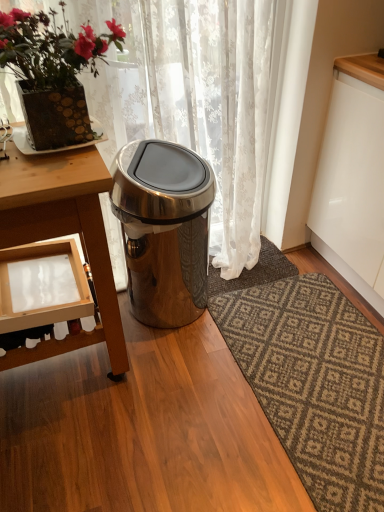
I want to click on free point to the right of satin silver trash can at center, so click(x=255, y=315).